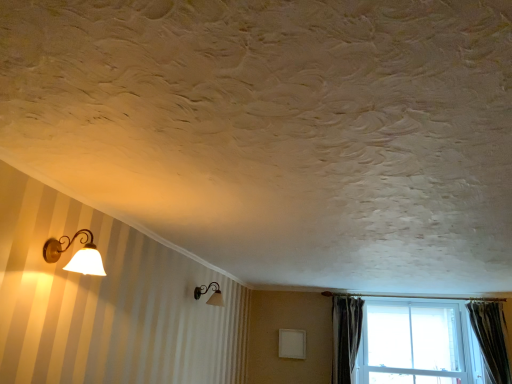
Find the location of a particular element. The image size is (512, 384). green textured curtain at right, the 2th curtain in the left-to-right sequence is located at coordinates (490, 338).

Where is `white glass window at lower right`? white glass window at lower right is located at coordinates pos(414,343).

Identify the location of matte glass lamp at upper left, which is the 1th lamp from bottom to top. The image size is (512, 384). (212, 294).

Is green textured curtain at right, the 2th curtain in the left-to-right sequence, behind white glass window at lower right?

No.

Is green textured curtain at right, the 1th curtain viewed from the right, positioned with its back to white glass window at lower right?

That's right, green textured curtain at right, the 1th curtain viewed from the right, is facing away from white glass window at lower right.

Who is smaller, green textured curtain at right, the 2th curtain in the left-to-right sequence, or white glass window at lower right?

Smaller between the two is green textured curtain at right, the 2th curtain in the left-to-right sequence.

Consider the image. Between green textured curtain at right, the 1th curtain viewed from the right, and white glass window at lower right, which one appears on the right side from the viewer's perspective?

green textured curtain at right, the 1th curtain viewed from the right, is more to the right.

Considering the relative positions of dark gray velvet curtain at right, which appears as the 1th curtain when viewed from the left, and matte glass lamp at upper left, which is the 1th lamp from bottom to top, in the image provided, is dark gray velvet curtain at right, which appears as the 1th curtain when viewed from the left, in front of matte glass lamp at upper left, which is the 1th lamp from bottom to top,?

No, dark gray velvet curtain at right, which appears as the 1th curtain when viewed from the left, is further to the viewer.

The image size is (512, 384). What are the coordinates of `curtain that is the 2nd one below the matte glass lamp at upper left, arranged as the second lamp when viewed from the left (from a real-world perspective)` in the screenshot? It's located at (345, 336).

Could you tell me if dark gray velvet curtain at right, placed as the 2th curtain when sorted from right to left, is facing matte glass lamp at upper left, the second lamp from the front?

No, dark gray velvet curtain at right, placed as the 2th curtain when sorted from right to left, is not facing towards matte glass lamp at upper left, the second lamp from the front.

From a real-world perspective, is dark gray velvet curtain at right, placed as the 2th curtain when sorted from right to left, above or below matte glass lamp at upper left, which is the 1th lamp from back to front?

From a real-world perspective, dark gray velvet curtain at right, placed as the 2th curtain when sorted from right to left, is physically below matte glass lamp at upper left, which is the 1th lamp from back to front.

From the image's perspective, is green textured curtain at right, the 1th curtain viewed from the right, located beneath matte gold wall sconce at left, the second lamp when ordered from back to front?

Indeed, from the image's perspective, green textured curtain at right, the 1th curtain viewed from the right, is shown beneath matte gold wall sconce at left, the second lamp when ordered from back to front.

In terms of width, does green textured curtain at right, the 1th curtain viewed from the right, look wider or thinner when compared to matte gold wall sconce at left, which is the 2th lamp from right to left?

Clearly, green textured curtain at right, the 1th curtain viewed from the right, has less width compared to matte gold wall sconce at left, which is the 2th lamp from right to left.

Does green textured curtain at right, the 2th curtain in the left-to-right sequence, turn towards matte gold wall sconce at left, placed as the 1th lamp when sorted from front to back?

No, green textured curtain at right, the 2th curtain in the left-to-right sequence, is not aimed at matte gold wall sconce at left, placed as the 1th lamp when sorted from front to back.

Consider the image. Is white glass window at lower right oriented away from matte glass lamp at upper left, acting as the 1th lamp starting from the right?

That's not correct — white glass window at lower right is not looking away from matte glass lamp at upper left, acting as the 1th lamp starting from the right.

Is white glass window at lower right not inside matte glass lamp at upper left, the second lamp from the front?

white glass window at lower right is positioned outside matte glass lamp at upper left, the second lamp from the front.

From a real-world perspective, who is located higher, white glass window at lower right or matte glass lamp at upper left, which is the 1th lamp from back to front?

matte glass lamp at upper left, which is the 1th lamp from back to front, from a real-world perspective.

Which is farther from the camera, (414, 359) or (195, 293)?

Point (414, 359)

Is dark gray velvet curtain at right, which appears as the 1th curtain when viewed from the left, aimed at white glass window at lower right?

No, dark gray velvet curtain at right, which appears as the 1th curtain when viewed from the left, is not aimed at white glass window at lower right.

From a real-world perspective, is dark gray velvet curtain at right, placed as the 2th curtain when sorted from right to left, above or below white glass window at lower right?

dark gray velvet curtain at right, placed as the 2th curtain when sorted from right to left, is below white glass window at lower right.

Who is taller, dark gray velvet curtain at right, placed as the 2th curtain when sorted from right to left, or white glass window at lower right?

white glass window at lower right.

From the image's perspective, is white glass window at lower right over dark gray velvet curtain at right, which appears as the 1th curtain when viewed from the left?

No, from the image's perspective, white glass window at lower right is not over dark gray velvet curtain at right, which appears as the 1th curtain when viewed from the left.

From the picture: Which of these two, white glass window at lower right or dark gray velvet curtain at right, which appears as the 1th curtain when viewed from the left, is wider?

white glass window at lower right is wider.

Which is nearer, (356, 363) or (354, 338)?

Clearly, point (356, 363) is closer to the camera than point (354, 338).

Is white glass window at lower right bigger than dark gray velvet curtain at right, which appears as the 1th curtain when viewed from the left?

Yes.

The width and height of the screenshot is (512, 384). Identify the location of lamp in front of the matte glass lamp at upper left, which appears as the second lamp when viewed from the top. (76, 254).

Are matte glass lamp at upper left, the second lamp from the front, and matte gold wall sconce at left, placed as the 2th lamp when sorted from bottom to top, making contact?

No.

From the image's perspective, is matte glass lamp at upper left, which is the 1th lamp from back to front, on matte gold wall sconce at left, which is the 1th lamp in left-to-right order?

No, from the image's perspective, matte glass lamp at upper left, which is the 1th lamp from back to front, is not on top of matte gold wall sconce at left, which is the 1th lamp in left-to-right order.

In order to click on window on the left side of green textured curtain at right, the 1th curtain viewed from the right in this screenshot , I will do [414, 343].

Find the location of a particular element. the 1st curtain counting from the right side of the matte glass lamp at upper left, which is the 1th lamp from back to front is located at coordinates (345, 336).

Looking at the image, which one is located further to green textured curtain at right, the 1th curtain viewed from the right, dark gray velvet curtain at right, placed as the 2th curtain when sorted from right to left, or white glass window at lower right?

Based on the image, dark gray velvet curtain at right, placed as the 2th curtain when sorted from right to left, appears to be further to green textured curtain at right, the 1th curtain viewed from the right.

Estimate the real-world distances between objects in this image. Which object is closer to matte glass lamp at upper left, the second lamp from the front, white glass window at lower right or dark gray velvet curtain at right, which appears as the 1th curtain when viewed from the left?

dark gray velvet curtain at right, which appears as the 1th curtain when viewed from the left, lies closer to matte glass lamp at upper left, the second lamp from the front, than the other object.

From the image, which object appears to be nearer to white glass window at lower right, dark gray velvet curtain at right, placed as the 2th curtain when sorted from right to left, or matte glass lamp at upper left, acting as the 1th lamp starting from the right?

dark gray velvet curtain at right, placed as the 2th curtain when sorted from right to left, is closer to white glass window at lower right.

From the image, which object appears to be farther from white glass window at lower right, matte glass lamp at upper left, which is the 1th lamp from back to front, or matte gold wall sconce at left, placed as the 2th lamp when sorted from bottom to top?

matte gold wall sconce at left, placed as the 2th lamp when sorted from bottom to top, is further to white glass window at lower right.

Considering their positions, is green textured curtain at right, the 2th curtain in the left-to-right sequence, positioned closer to matte glass lamp at upper left, which appears as the second lamp when viewed from the top, than white glass window at lower right?

white glass window at lower right.

From the image, which object appears to be nearer to white glass window at lower right, matte glass lamp at upper left, which is the 1th lamp from bottom to top, or green textured curtain at right, the 1th curtain viewed from the right?

green textured curtain at right, the 1th curtain viewed from the right.

When comparing their distances from matte gold wall sconce at left, which is the 1th lamp in left-to-right order, does white glass window at lower right or dark gray velvet curtain at right, placed as the 2th curtain when sorted from right to left, seem closer?

dark gray velvet curtain at right, placed as the 2th curtain when sorted from right to left.

From the image, which object appears to be nearer to matte gold wall sconce at left, placed as the 2th lamp when sorted from bottom to top, matte glass lamp at upper left, which is the 1th lamp from back to front, or white glass window at lower right?

matte glass lamp at upper left, which is the 1th lamp from back to front, is positioned closer to the anchor matte gold wall sconce at left, placed as the 2th lamp when sorted from bottom to top.

Find the location of a particular element. This screenshot has width=512, height=384. curtain located between matte gold wall sconce at left, placed as the 1th lamp when sorted from front to back, and green textured curtain at right, the 1th curtain viewed from the right, in the left-right direction is located at coordinates (345, 336).

This screenshot has height=384, width=512. What are the coordinates of `window situated between matte glass lamp at upper left, which appears as the second lamp when viewed from the top, and green textured curtain at right, the 1th curtain viewed from the right, from left to right` in the screenshot? It's located at (414, 343).

What are the coordinates of `curtain between matte glass lamp at upper left, the second lamp from the front, and white glass window at lower right from left to right` in the screenshot? It's located at (345, 336).

You are a GUI agent. You are given a task and a screenshot of the screen. Output one action in this format:
    pyautogui.click(x=<x>, y=<y>)
    Task: Click on the window located between matte gold wall sconce at left, placed as the 2th lamp when sorted from bottom to top, and green textured curtain at right, the 2th curtain in the left-to-right sequence, in the left-right direction
    Image resolution: width=512 pixels, height=384 pixels.
    Given the screenshot: What is the action you would take?
    pyautogui.click(x=414, y=343)